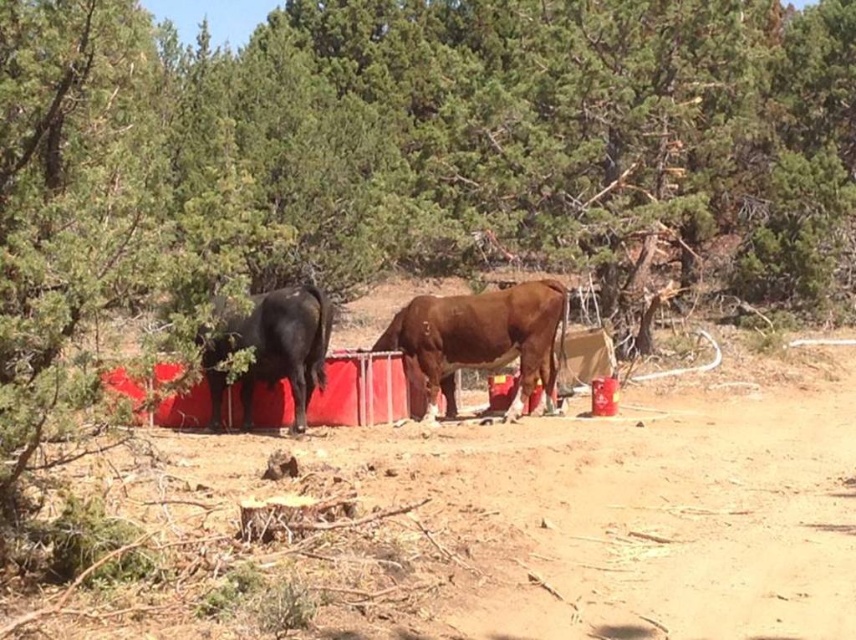
Question: Which object is farther from the camera taking this photo?

Choices:
 (A) brown matte cow at center
 (B) shiny black bull at left

Answer: (A)

Question: Does dirt field at center come behind brown matte cow at center?

Choices:
 (A) yes
 (B) no

Answer: (B)

Question: Can you confirm if dirt field at center is positioned to the right of brown matte cow at center?

Choices:
 (A) no
 (B) yes

Answer: (B)

Question: Which of the following is the closest to the observer?

Choices:
 (A) (501, 531)
 (B) (560, 300)

Answer: (A)

Question: Does dirt field at center come in front of shiny black bull at left?

Choices:
 (A) yes
 (B) no

Answer: (A)

Question: Which of these objects is positioned closest to the dirt field at center?

Choices:
 (A) shiny black bull at left
 (B) brown matte cow at center

Answer: (A)